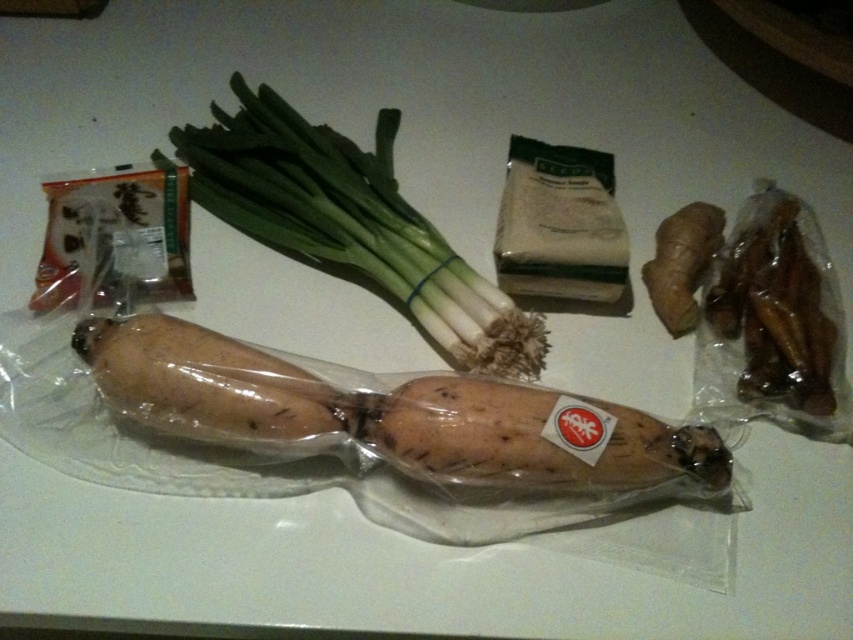
Question: Which of these objects is positioned farthest from the green leafy at center?

Choices:
 (A) brown glossy dried mushrooms at right
 (B) brown matte sweet potato at center
 (C) brown rough ginger at upper right

Answer: (A)

Question: Which point is farther to the camera?

Choices:
 (A) (453, 397)
 (B) (697, 256)
 (C) (839, 336)

Answer: (B)

Question: Does brown matte sweet potato at center have a larger size compared to brown rough ginger at upper right?

Choices:
 (A) no
 (B) yes

Answer: (B)

Question: Can you confirm if brown glossy dried mushrooms at right is smaller than brown rough ginger at upper right?

Choices:
 (A) yes
 (B) no

Answer: (B)

Question: Which of the following is the closest to the observer?

Choices:
 (A) brown glossy dried mushrooms at right
 (B) green leafy at center
 (C) brown matte sweet potato at center

Answer: (C)

Question: Does brown matte sweet potato at center have a larger size compared to brown rough ginger at upper right?

Choices:
 (A) no
 (B) yes

Answer: (B)